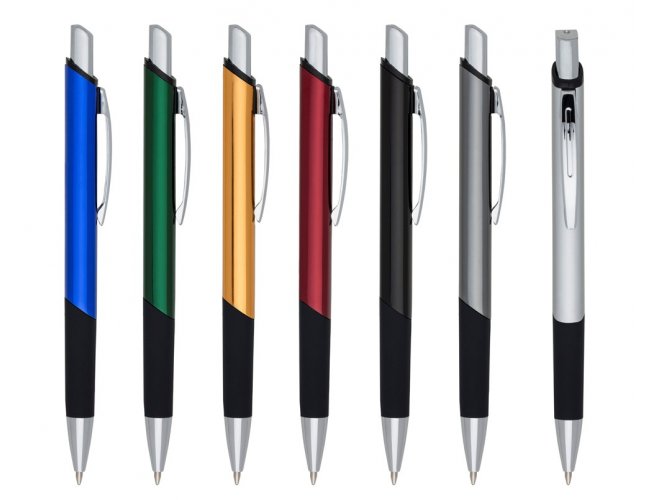
This screenshot has height=500, width=650. In order to click on pens in this screenshot , I will do `click(80, 220)`, `click(156, 218)`, `click(242, 217)`, `click(315, 221)`, `click(392, 229)`, `click(469, 237)`, `click(561, 237)`.